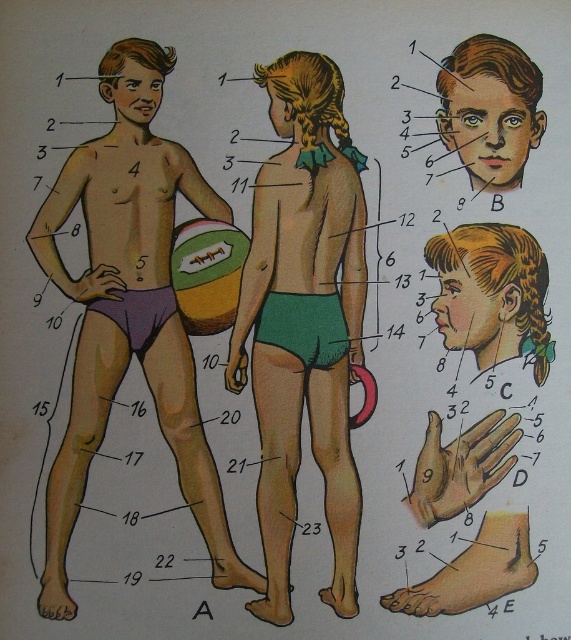
Question: Is green matte shorts at center thinner than green rubber beach ball at lower center?

Choices:
 (A) no
 (B) yes

Answer: (A)

Question: Is the position of purple matte shorts at left more distant than that of matte brown hair at upper center?

Choices:
 (A) yes
 (B) no

Answer: (B)

Question: Which point is farther from the camera taking this photo?

Choices:
 (A) (445, 516)
 (B) (331, 406)
 (C) (218, 282)
 (D) (528, 147)

Answer: (B)

Question: Considering the real-world distances, which object is farthest from the green matte shorts at center?

Choices:
 (A) purple matte underwear at lower left
 (B) purple matte shorts at left

Answer: (A)

Question: Which point is farther to the camera?

Choices:
 (A) (131, 321)
 (B) (347, 340)
 (C) (151, 230)
 (D) (500, 72)

Answer: (B)

Question: Where is purple matte shorts at left located in relation to green fabric shorts at lower center in the image?

Choices:
 (A) right
 (B) left

Answer: (B)